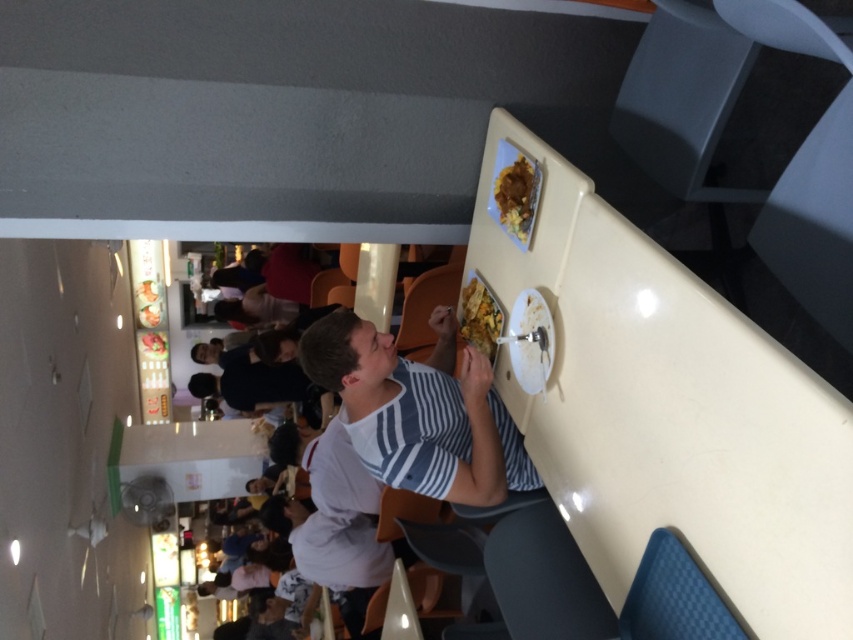
Consider the image. You are a photographer taking a picture of the dining scene. You need to ensure that both the white striped shirt at center and the golden crispy fries at upper center are clearly visible in the frame. Which object should you focus on first to ensure both are in focus, considering their sizes?

The white striped shirt at center is wider than the golden crispy fries at upper center, so focusing on the wider object first would help ensure both are in focus.

You are a food delivery person who needs to place a hot meal on the table. The meal must be placed within 15 feet of the white striped shirt at center to ensure it stays warm. Can you safely place the meal on the table near the smooth yellow rice at upper center?

The distance between the white striped shirt at center and the smooth yellow rice at upper center is 17.80 feet, which exceeds the 15 feet requirement. Therefore, placing the meal near the smooth yellow rice at upper center would be too far to keep it warm.

You are a food delivery person standing behind the table. You need to place a new order on the table without disturbing the existing items. Considering the white striped shirt at center and the smooth yellow rice at upper center, which object is taller and should you be cautious about when placing the order?

The white striped shirt at center is taller than the smooth yellow rice at upper center. When placing the new order, you should be cautious of the white striped shirt at center to avoid knocking it over.